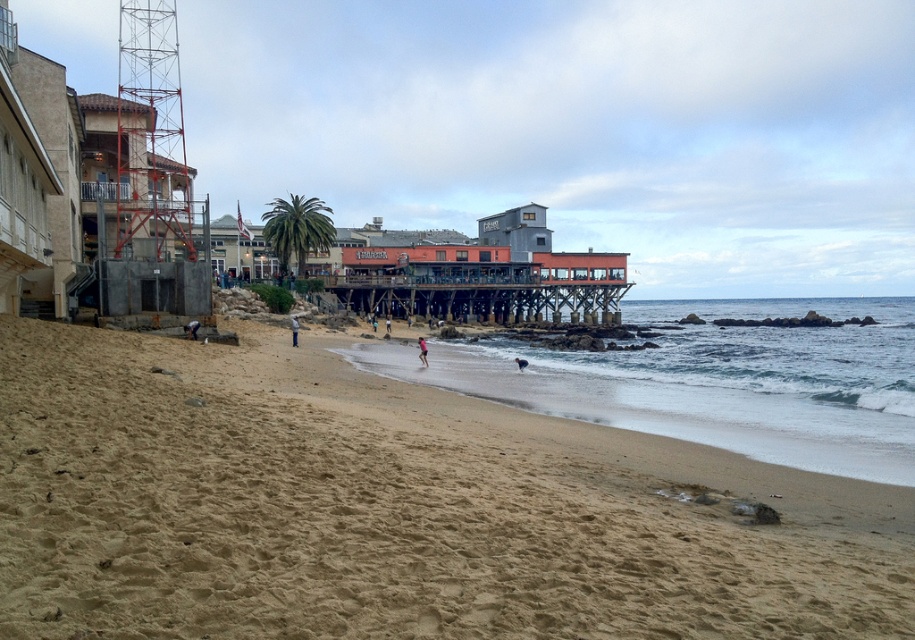
You are a photographer standing on the beach and want to capture both the wooden pier at center and the light blue denim shorts at lower center in a single frame. Which object should you focus on first to ensure both are in the shot?

You should focus on the wooden pier at center first because it is larger than the light blue denim shorts at lower center, allowing you to frame the scene so both objects are included.